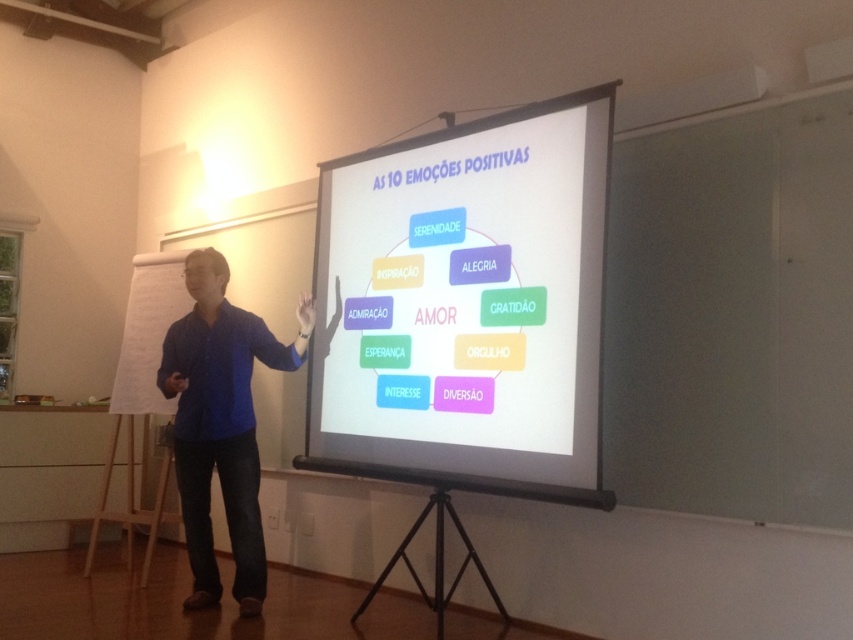
Who is higher up, white matte projection screen at center or blue shirt at center?

Positioned higher is white matte projection screen at center.

Is point (363, 397) in front of point (221, 472)?

Yes.

Who is more forward, (560, 298) or (198, 404)?

Point (560, 298) is in front.

Image resolution: width=853 pixels, height=640 pixels. Find the location of `white matte projection screen at center`. white matte projection screen at center is located at coordinates (465, 305).